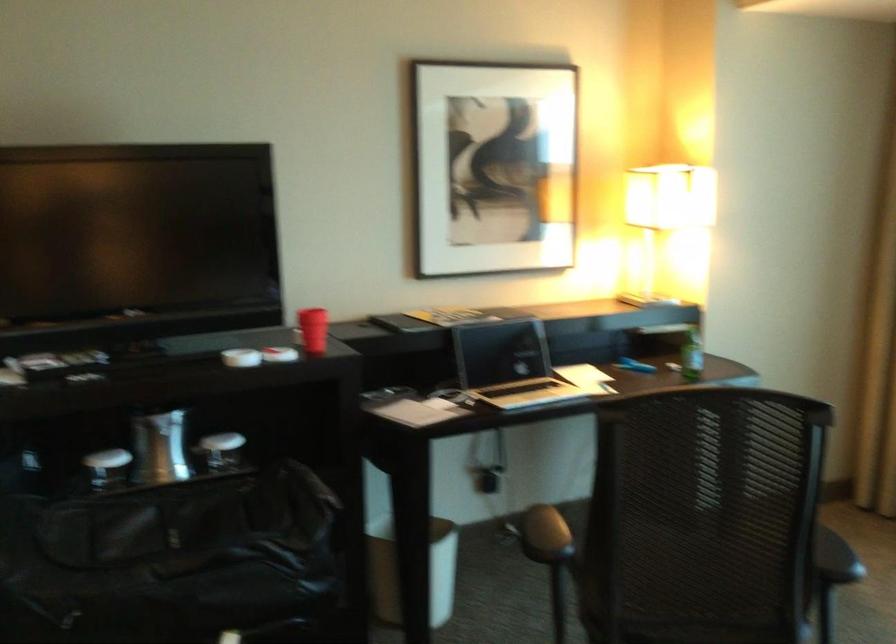
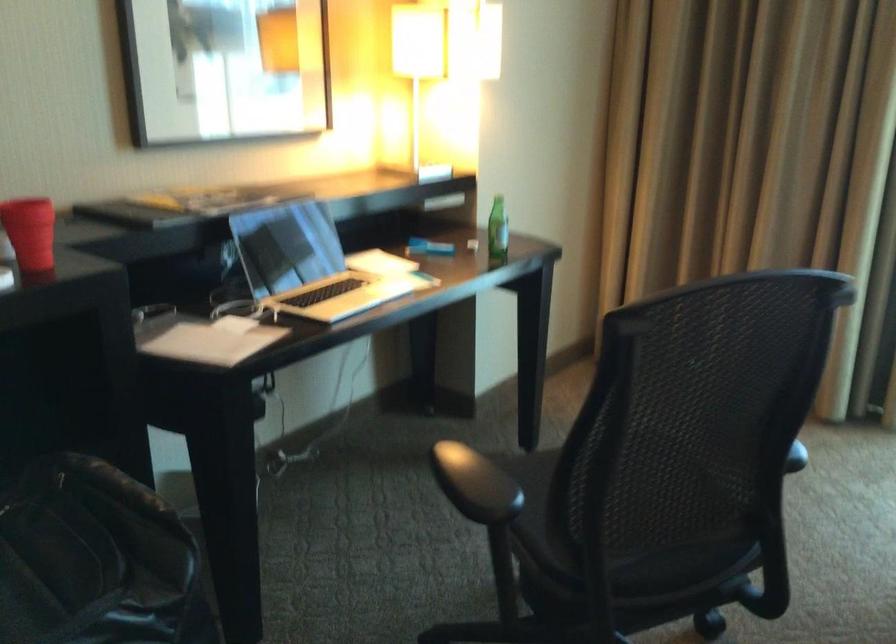
The point at (692, 351) is marked in the first image. Where is the corresponding point in the second image?

(497, 229)